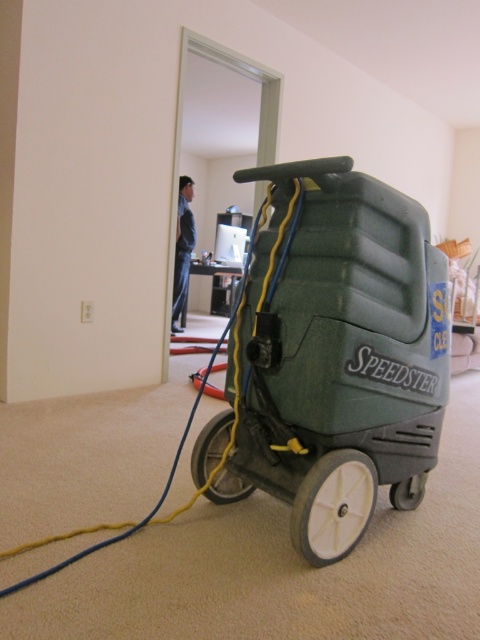
Consider the image. You are a customer service representative for a carpet cleaning company. A client calls and says they just bought the green plastic carpet cleaner at center and blue jeans at center. They want to know if the carpet cleaner is shorter than their jeans. How do you respond?

The green plastic carpet cleaner at center is shorter than blue jeans at center, so yes, the carpet cleaner is shorter than their jeans.